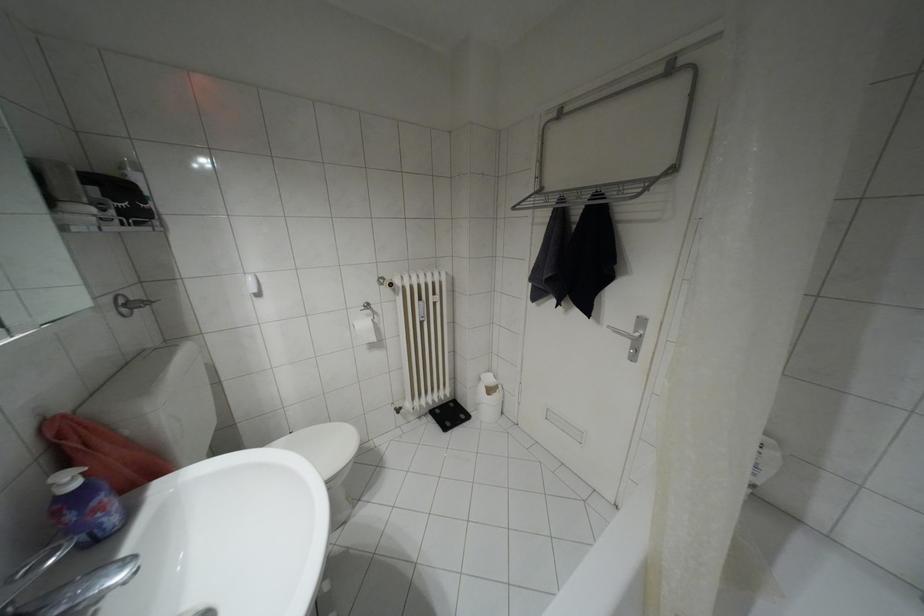
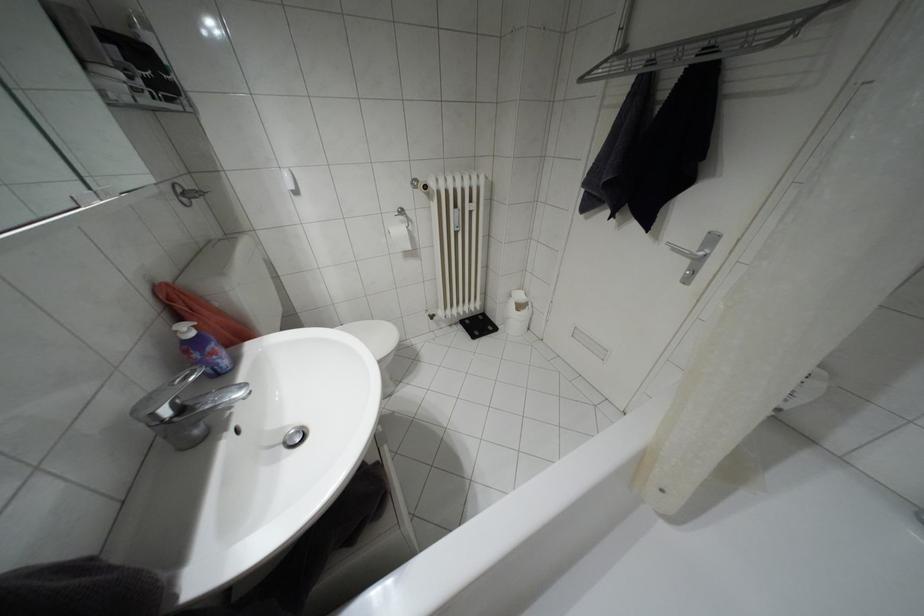
Where in the second image is the point corresponding to [489,379] from the first image?

(518, 296)